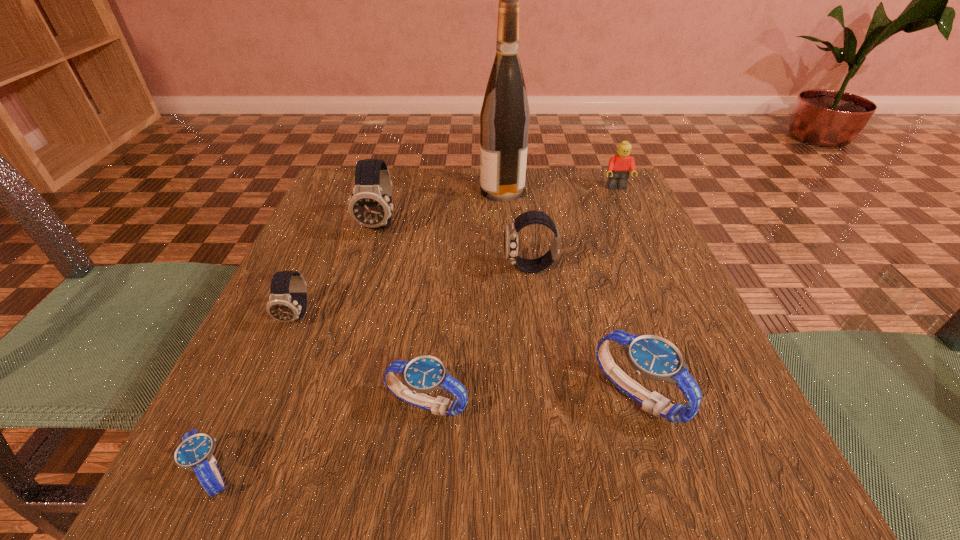
I want to click on empty space that is in between the second shortest object and the second biggest dark watch, so click(479, 336).

Locate an element on the screen. The width and height of the screenshot is (960, 540). free space between the wine bottle and the shortest object is located at coordinates (357, 332).

Identify the location of free space that is in between the rightmost blue watch and the nearest watch. This screenshot has height=540, width=960. (425, 434).

Find the location of a particular element. The height and width of the screenshot is (540, 960). vacant space that is in between the seventh object from left to right and the fourth farthest object is located at coordinates (584, 332).

Locate an element on the screen. The image size is (960, 540). vacant space that's between the Lego and the farthest dark watch is located at coordinates (498, 206).

Find the location of a particular element. Image resolution: width=960 pixels, height=540 pixels. vacant space that's between the tallest object and the rightmost object is located at coordinates (560, 189).

Locate an element on the screen. vacant space in between the rightmost watch and the wine bottle is located at coordinates (570, 293).

The height and width of the screenshot is (540, 960). I want to click on empty space that is in between the biggest blue watch and the second biggest blue watch, so click(x=533, y=400).

Image resolution: width=960 pixels, height=540 pixels. I want to click on free space between the nearest watch and the second shortest watch, so click(320, 438).

I want to click on vacant region between the second farthest dark watch and the Lego, so click(573, 228).